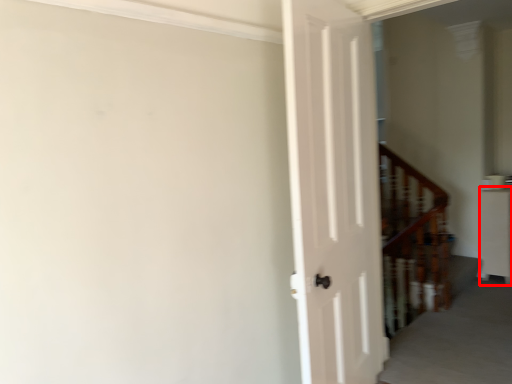
Question: From the image's perspective, what is the correct spatial positioning of furniture (annotated by the red box) in reference to stairwell?

Choices:
 (A) below
 (B) above

Answer: (A)